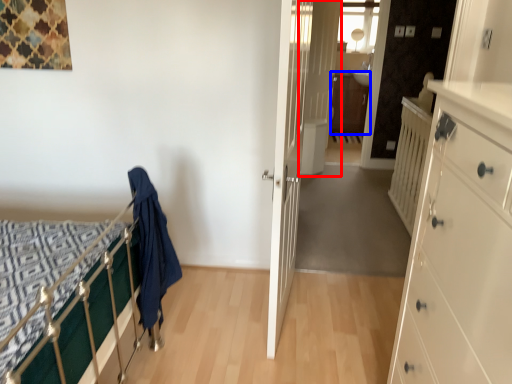
Question: Among these objects, which one is nearest to the camera, door (highlighted by a red box) or file cabinet (highlighted by a blue box)?

Choices:
 (A) door
 (B) file cabinet

Answer: (A)